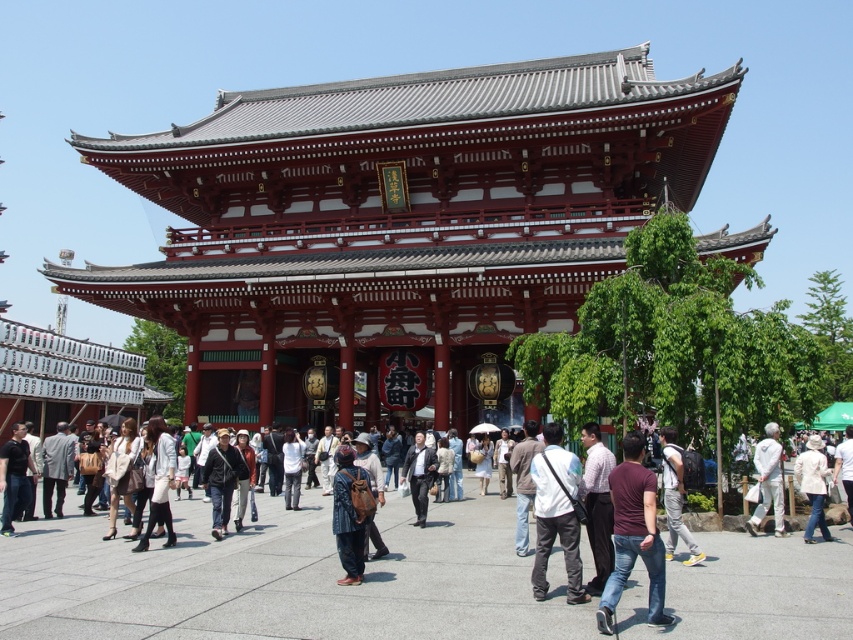
You are a photographer standing in front of the temple. You see the dark gray backpack at center and the light beige fabric jacket at center. Which item is positioned higher in the scene?

The dark gray backpack at center is positioned higher than the light beige fabric jacket at center.

You are standing in front of the temple and want to take a photo that includes both the point at coordinate (672, 541) and the point at coordinate (413, 456). Which point should you focus on first to ensure both are in clear view?

You should focus on point (672, 541) first because it is closer to you than point (413, 456), ensuring both points remain in clear view.